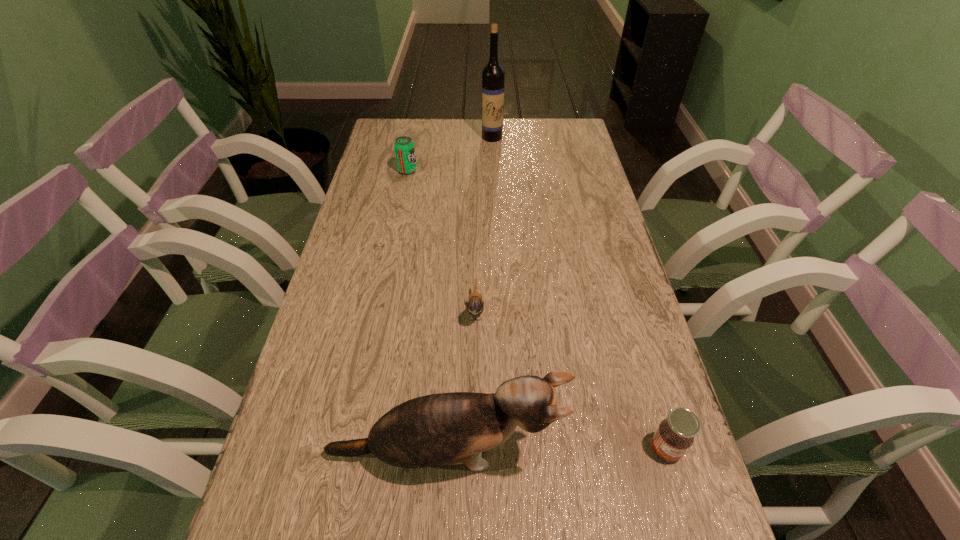
Choose which object is the third nearest neighbor to the third farthest object. Please provide its 2D coordinates. Your answer should be formatted as a tuple, i.e. [(x, y)], where the tuple contains the x and y coordinates of a point satisfying the conditions above.

[(404, 147)]

Where is `the second closest object to the jam`? Image resolution: width=960 pixels, height=540 pixels. the second closest object to the jam is located at coordinates (475, 305).

This screenshot has width=960, height=540. In order to click on blank space that satisfies the following two spatial constraints: 1. on the label side of the jam; 2. at the face of the fourth shortest object in this screenshot , I will do `click(667, 454)`.

The image size is (960, 540). I want to click on vacant position in the image that satisfies the following two spatial constraints: 1. on the front-facing side of the kitten; 2. at the face of the cat, so click(474, 454).

At what (x,y) coordinates should I click in order to perform the action: click on free location that satisfies the following two spatial constraints: 1. on the front-facing side of the shortest object; 2. at the face of the second tallest object. Please return your answer as a coordinate pair (x, y). Looking at the image, I should click on (474, 454).